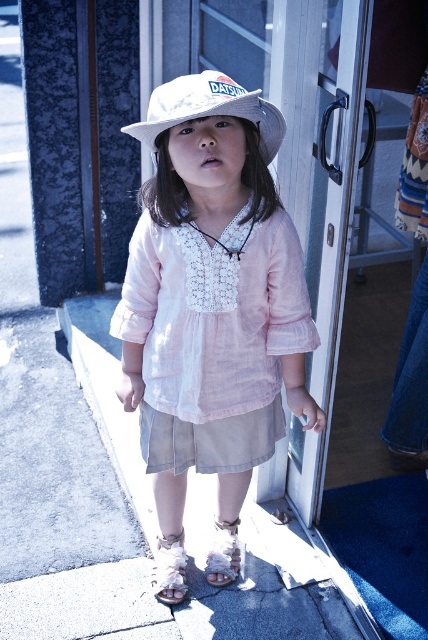
This screenshot has height=640, width=428. I want to click on white straw hat at center, so click(208, 109).

Does white straw hat at center appear on the left side of white fabric sandal at lower center?

No, white straw hat at center is not to the left of white fabric sandal at lower center.

Looking at this image, measure the distance between white straw hat at center and camera.

They are 1.64 meters apart.

Image resolution: width=428 pixels, height=640 pixels. I want to click on white straw hat at center, so click(208, 109).

What do you see at coordinates (211, 296) in the screenshot? I see `matte white hat at center` at bounding box center [211, 296].

The height and width of the screenshot is (640, 428). Find the location of `matte white hat at center`. matte white hat at center is located at coordinates (211, 296).

Which is in front, point (162, 550) or point (216, 525)?

Point (162, 550)

Between white fabric sandal at lower center and white fuzzy sandal at lower center, which one is positioned lower?

white fabric sandal at lower center

Is point (163, 554) behind point (220, 557)?

Yes, it is behind point (220, 557).

Find the location of `white fabric sandal at lower center`. white fabric sandal at lower center is located at coordinates tap(169, 570).